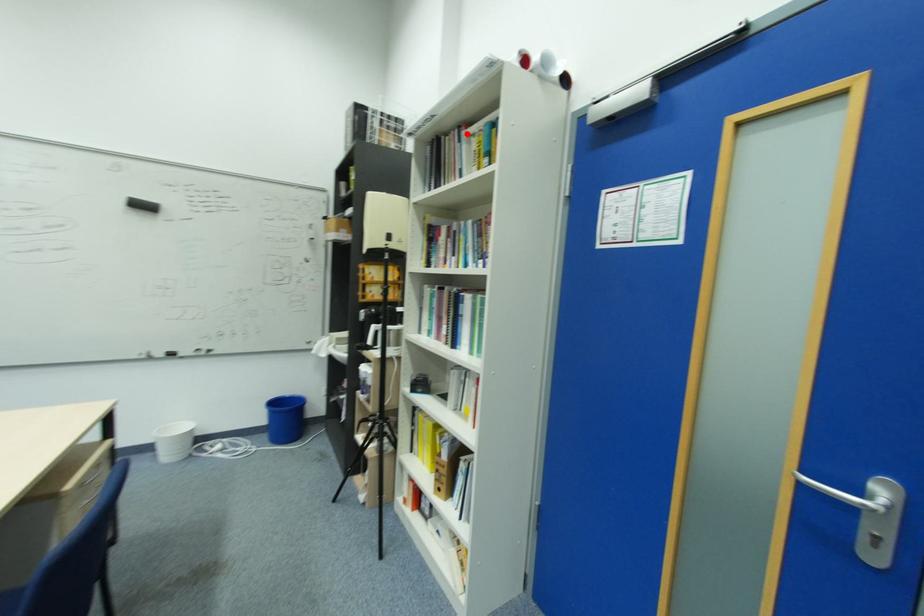
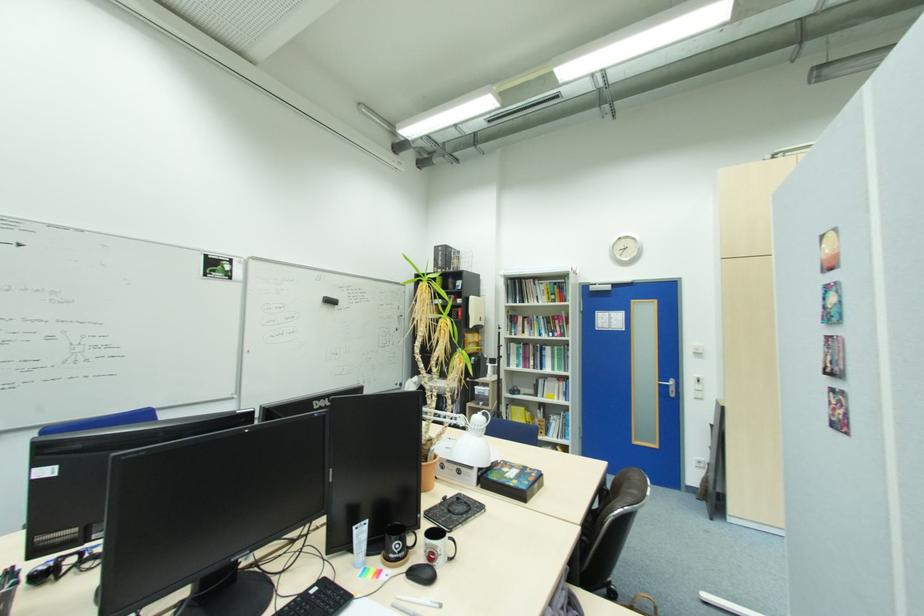
Locate, in the second image, the point that corresponds to the highlighted location in the first image.

(541, 283)